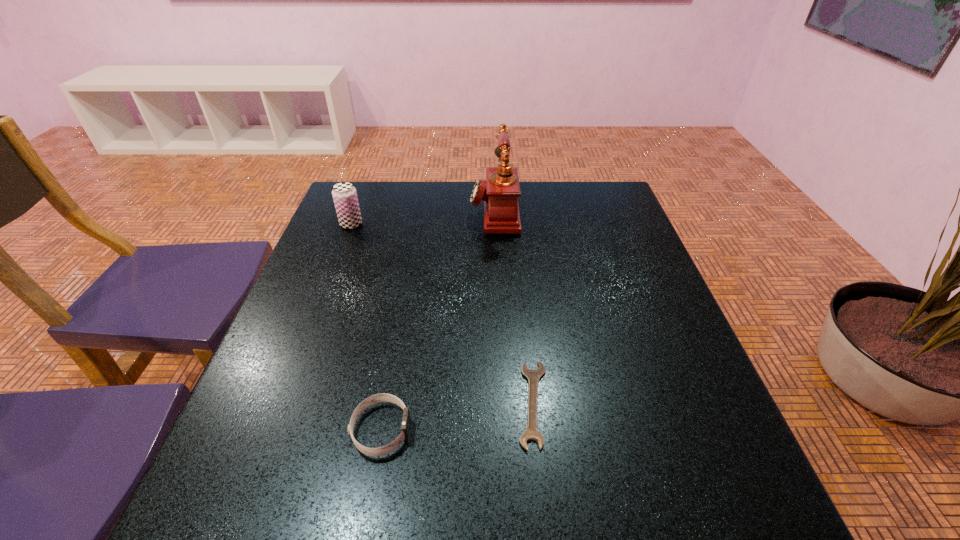
Locate an element on the screen. This screenshot has width=960, height=540. the tallest object is located at coordinates (500, 192).

Image resolution: width=960 pixels, height=540 pixels. What are the coordinates of `the leftmost object` in the screenshot? It's located at (344, 194).

The height and width of the screenshot is (540, 960). I want to click on beer can, so click(x=344, y=194).

Identify the location of the third object from right to left. Image resolution: width=960 pixels, height=540 pixels. (383, 397).

This screenshot has height=540, width=960. I want to click on the third tallest object, so click(x=383, y=397).

Identify the location of wrench. (533, 376).

I want to click on vacant space located 0.050m on the dial of the telephone, so click(453, 211).

You are a GUI agent. You are given a task and a screenshot of the screen. Output one action in this format:
    pyautogui.click(x=<x>, y=<y>)
    Task: Click on the blank space located on the dial of the telephone
    Image resolution: width=960 pixels, height=540 pixels.
    Given the screenshot: What is the action you would take?
    pyautogui.click(x=369, y=211)

The width and height of the screenshot is (960, 540). In order to click on free space located 0.070m on the dial of the telephone in this screenshot , I will do `click(446, 211)`.

Locate an element on the screen. free space located on the front of the beer can is located at coordinates (309, 333).